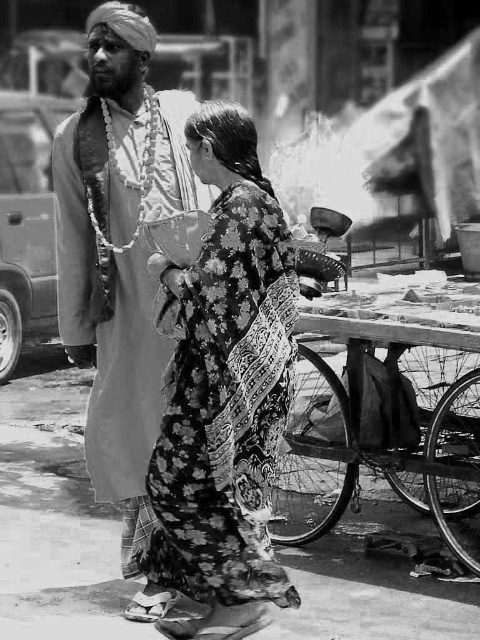
Question: Does floral-patterned fabric at center appear under smooth fabric turban at upper left?

Choices:
 (A) yes
 (B) no

Answer: (A)

Question: Which of these objects is positioned closest to the wooden cart at lower right?

Choices:
 (A) floral-patterned fabric at center
 (B) smooth fabric turban at upper left

Answer: (A)

Question: Can you confirm if floral-patterned fabric at center is thinner than wooden cart at lower right?

Choices:
 (A) yes
 (B) no

Answer: (A)

Question: Among these points, which one is nearest to the camera?

Choices:
 (A) (345, 316)
 (B) (70, 340)
 (C) (202, 403)

Answer: (C)

Question: Can you confirm if smooth fabric turban at upper left is bigger than wooden cart at lower right?

Choices:
 (A) yes
 (B) no

Answer: (B)

Question: Which object is closer to the camera taking this photo?

Choices:
 (A) smooth fabric turban at upper left
 (B) floral-patterned fabric at center

Answer: (B)